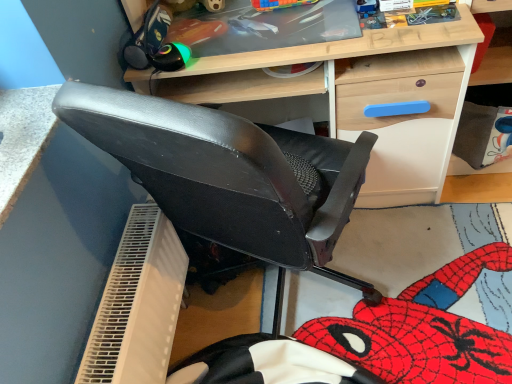
Where is `free point above white textured table at upper left (from a real-world perspective)`? The image size is (512, 384). free point above white textured table at upper left (from a real-world perspective) is located at coordinates (20, 130).